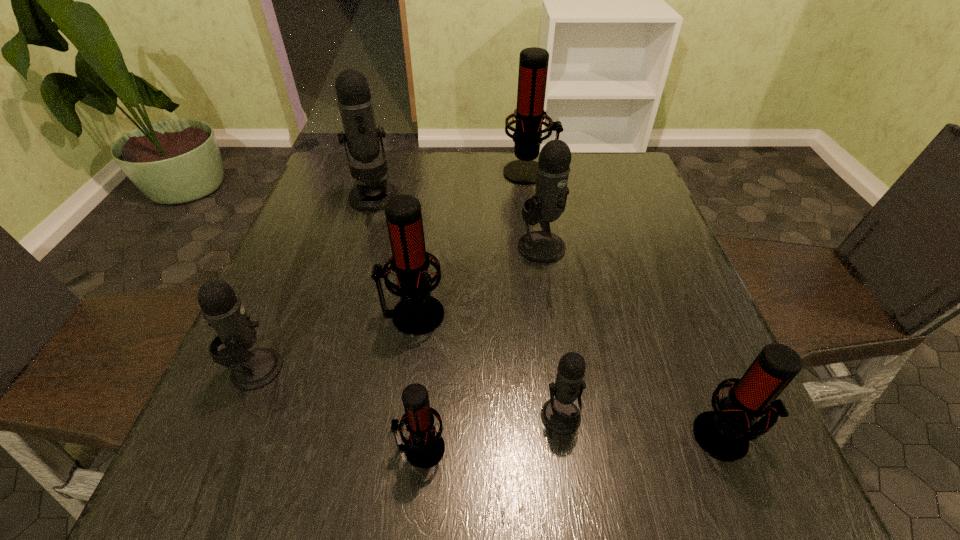
The height and width of the screenshot is (540, 960). What are the coordinates of `free location located 0.170m on the left of the smallest black microphone` in the screenshot? It's located at (437, 417).

The image size is (960, 540). Identify the location of blank area located 0.310m on the right of the smallest red microphone. (645, 449).

Where is `object located in the right edge section of the desktop`? The width and height of the screenshot is (960, 540). object located in the right edge section of the desktop is located at coordinates (724, 433).

This screenshot has width=960, height=540. What are the coordinates of `object at the far left corner` in the screenshot? It's located at (x=355, y=103).

Locate an element on the screen. object present at the near right corner is located at coordinates (724, 433).

In the image, there is a desktop. Find the location of `vacant space at the far edge`. vacant space at the far edge is located at coordinates (462, 170).

At what (x,y) coordinates should I click in order to perform the action: click on vacant region at the near edge of the desktop. Please return your answer as a coordinate pair (x, y). The width and height of the screenshot is (960, 540). Looking at the image, I should click on (580, 478).

In the image, there is a desktop. Identify the location of vacant space at the left edge. This screenshot has height=540, width=960. (312, 200).

You are a GUI agent. You are given a task and a screenshot of the screen. Output one action in this format:
    pyautogui.click(x=<x>, y=<y>)
    Task: Click on the free spot at the right edge of the desktop
    
    Given the screenshot: What is the action you would take?
    pyautogui.click(x=636, y=252)

Find the location of a particular element. The image size is (960, 540). vacant space at the far right corner of the desktop is located at coordinates (591, 161).